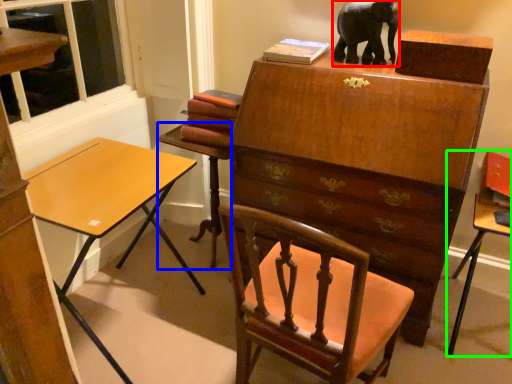
Question: Which object is positioned closest to elephant (highlighted by a red box)? Select from table (highlighted by a blue box) and table (highlighted by a green box).

Choices:
 (A) table
 (B) table

Answer: (B)